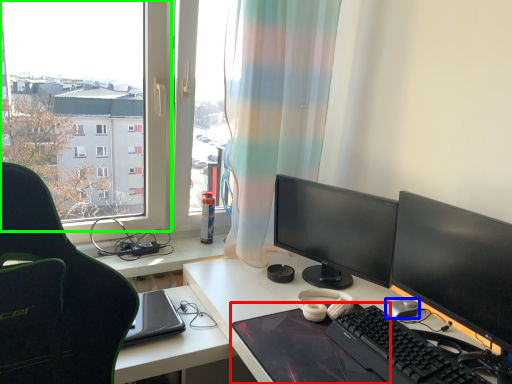
Question: Which is nearer to the mousepad (highlighted by a red box)? mouse (highlighted by a blue box) or window (highlighted by a green box).

Choices:
 (A) mouse
 (B) window

Answer: (A)